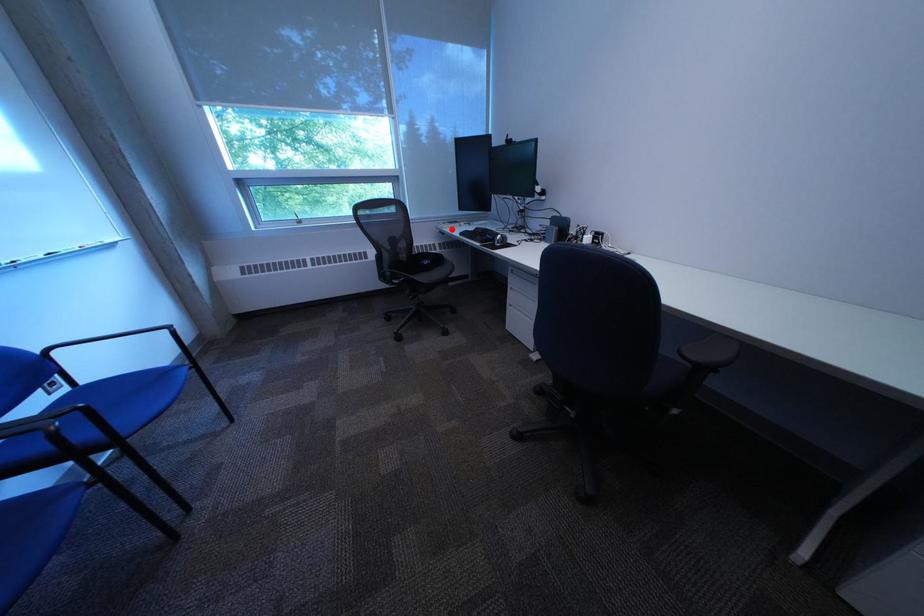
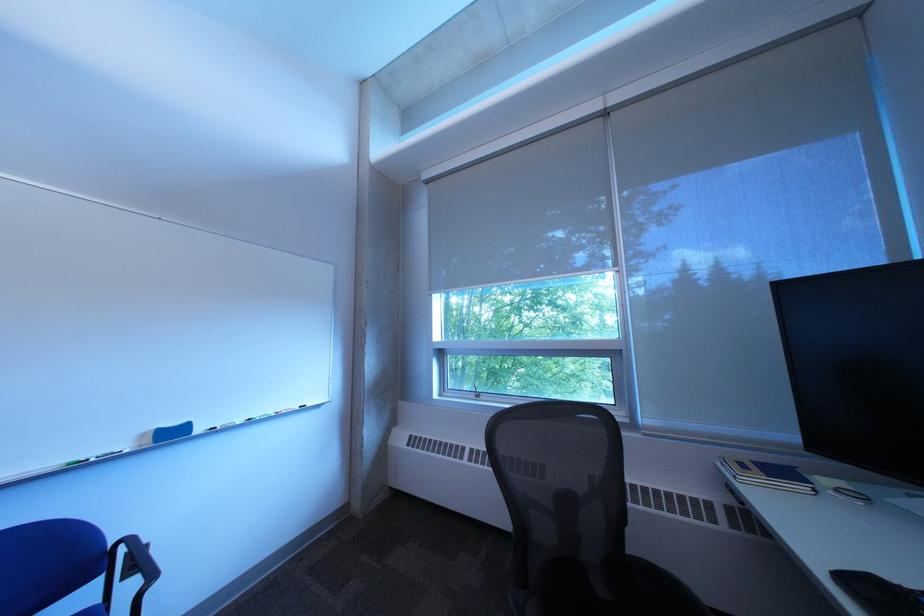
In the second image, find the point that corresponds to the highlighted location in the first image.

(733, 468)